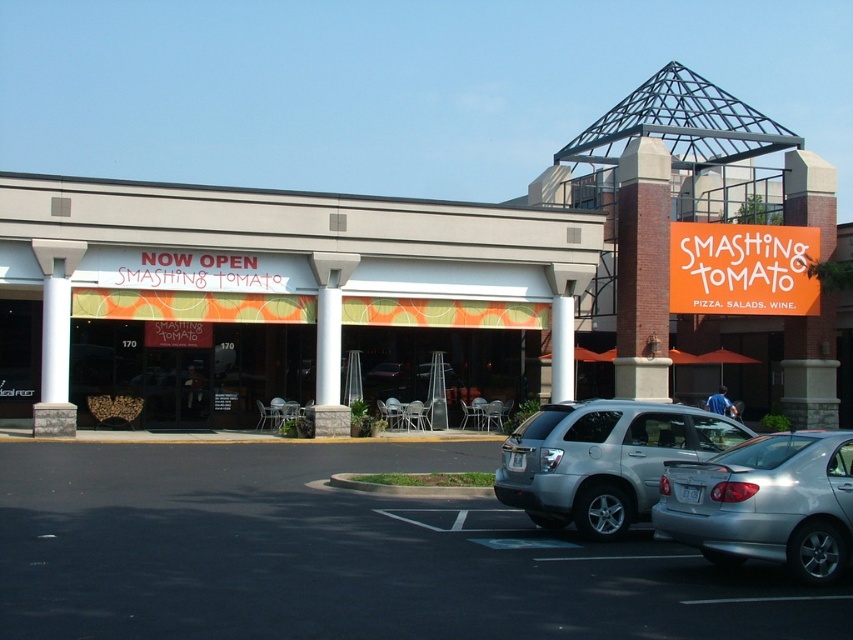
Question: Estimate the real-world distances between objects in this image. Which object is closer to the silver metallic suv at lower right?

Choices:
 (A) matte orange awning at center
 (B) black asphalt parking lot at lower left
 (C) silver metallic sedan at lower right

Answer: (C)

Question: Which of the following is the closest to the observer?

Choices:
 (A) silver metallic sedan at lower right
 (B) black asphalt parking lot at lower left
 (C) silver metallic suv at lower right
 (D) orange plastic sign at upper center

Answer: (B)

Question: Which is nearer to the silver metallic suv at lower right?

Choices:
 (A) black asphalt parking lot at lower left
 (B) orange fabric awning at center
 (C) silver metallic sedan at lower right
 (D) matte orange awning at center

Answer: (C)

Question: Considering the relative positions of black asphalt parking lot at lower left and silver metallic suv at lower right in the image provided, where is black asphalt parking lot at lower left located with respect to silver metallic suv at lower right?

Choices:
 (A) below
 (B) above

Answer: (A)

Question: Is orange fabric awning at center in front of orange plastic sign at upper center?

Choices:
 (A) no
 (B) yes

Answer: (B)

Question: Is orange fabric awning at center further to camera compared to black asphalt parking lot at lower left?

Choices:
 (A) no
 (B) yes

Answer: (B)